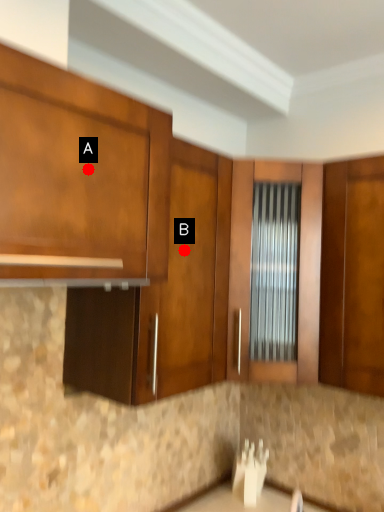
Question: Two points are circled on the image, labeled by A and B beside each circle. Which point is closer to the camera?

Choices:
 (A) A is closer
 (B) B is closer

Answer: (A)